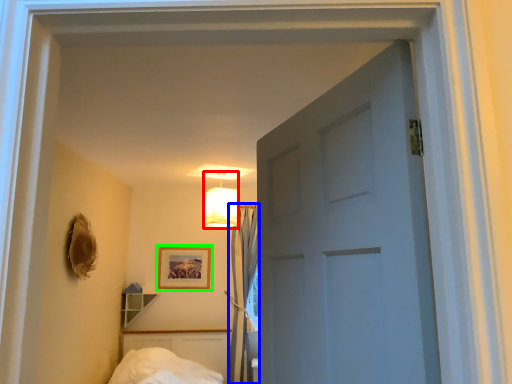
Question: Estimate the real-world distances between objects in this image. Which object is closer to lamp (highlighted by a red box), curtain (highlighted by a blue box) or picture frame (highlighted by a green box)?

Choices:
 (A) curtain
 (B) picture frame

Answer: (A)